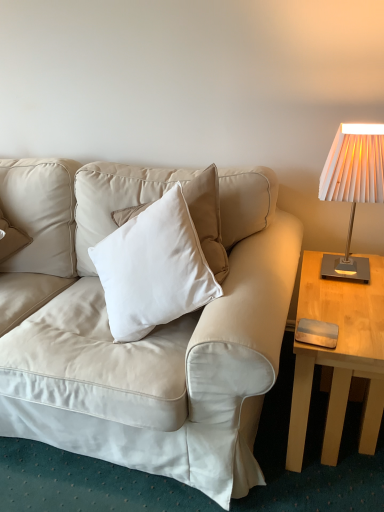
The width and height of the screenshot is (384, 512). In order to click on vacant space underneath white pleated fabric lampshade at right (from a real-world perspective) in this screenshot , I will do `click(352, 272)`.